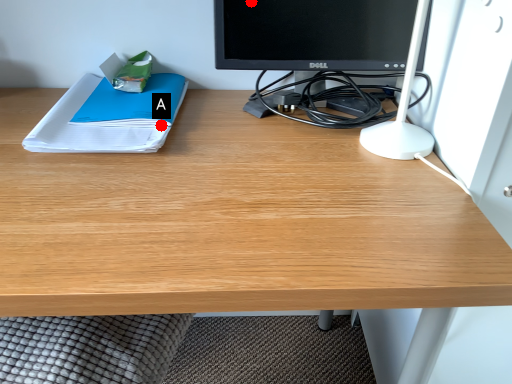
Question: Two points are circled on the image, labeled by A and B beside each circle. Which of the following is the farthest from the observer?

Choices:
 (A) A is further
 (B) B is further

Answer: (A)